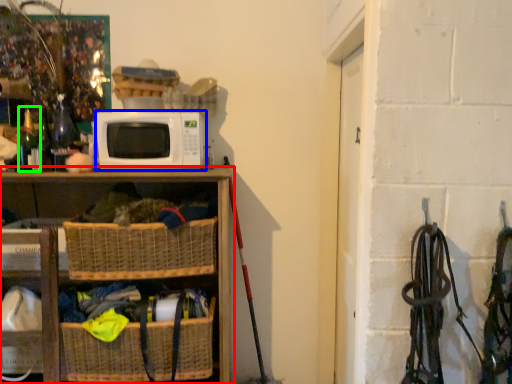
Question: Which object is positioned farthest from shelf (highlighted by a red box)? Select from microwave oven (highlighted by a blue box) and bottle (highlighted by a green box).

Choices:
 (A) microwave oven
 (B) bottle

Answer: (B)